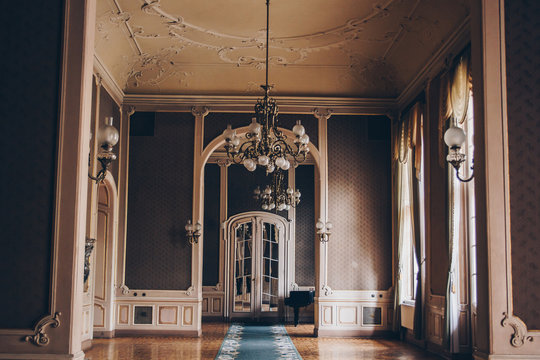
This screenshot has width=540, height=360. Identify the location of brown walls. (x=173, y=249), (x=360, y=223), (x=32, y=208), (x=528, y=214).